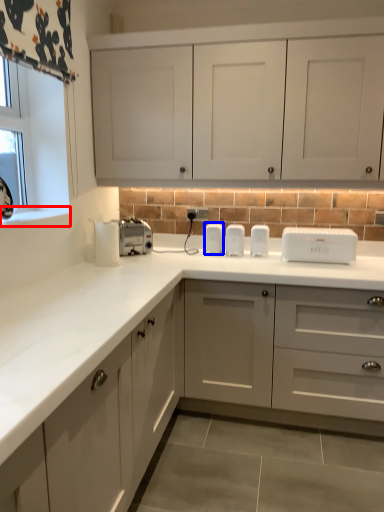
Question: Which object appears farthest to the camera in this image, window sill (highlighted by a red box) or appliance (highlighted by a blue box)?

Choices:
 (A) window sill
 (B) appliance

Answer: (B)